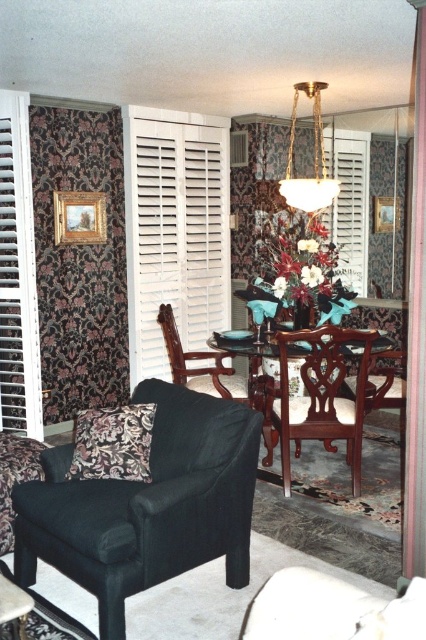
Question: Which point appears farthest from the camera in this image?

Choices:
 (A) (54, 241)
 (B) (218, 180)

Answer: (B)

Question: Does velvet dark brown armchair at center lie behind gold metallic chandelier at upper center?

Choices:
 (A) yes
 (B) no

Answer: (B)

Question: Is white wooden shutter at left below velvet black couch at lower left?

Choices:
 (A) no
 (B) yes

Answer: (A)

Question: Which point appears closest to the camera in this image?

Choices:
 (A) (379, 620)
 (B) (222, 148)
 (C) (2, 490)

Answer: (A)

Question: Is damask fabric curtain at left to the right of mahogany wood armchair at center from the viewer's perspective?

Choices:
 (A) yes
 (B) no

Answer: (B)

Question: Which of these objects is positioned closest to the white wood shutter at right?

Choices:
 (A) damask fabric curtain at left
 (B) white wooden shutter at left

Answer: (A)